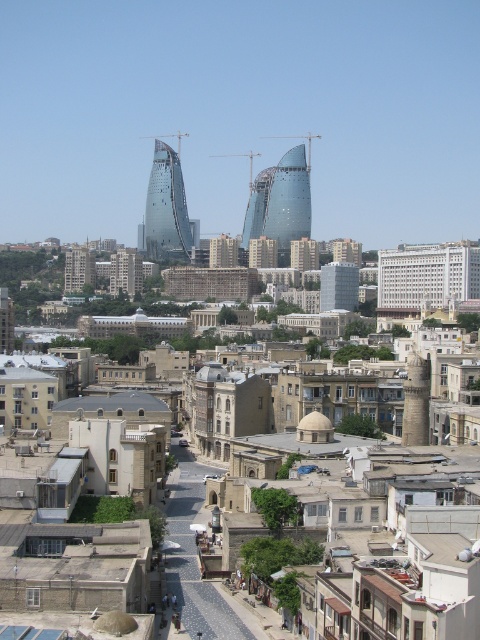
Does glassy steel tower at center have a larger size compared to glassy steel twin towers at center?

Yes, glassy steel tower at center is bigger than glassy steel twin towers at center.

Is glassy steel tower at center taller than glassy steel twin towers at center?

Incorrect, glassy steel tower at center's height is not larger of glassy steel twin towers at center's.

Measure the distance between glassy steel tower at center and camera.

They are 592.75 meters apart.

Identify the location of glassy steel tower at center. The width and height of the screenshot is (480, 640). (279, 204).

Is glassy steel tower at center to the right of matte glass building at center from the viewer's perspective?

No, glassy steel tower at center is not to the right of matte glass building at center.

Which is more to the right, glassy steel tower at center or matte glass building at center?

From the viewer's perspective, matte glass building at center appears more on the right side.

Measure the distance between glassy steel tower at center and camera.

glassy steel tower at center is 592.75 meters from camera.

Identify the location of glassy steel tower at center. This screenshot has width=480, height=640. (279, 204).

Which is in front, point (159, 189) or point (335, 282)?

Point (335, 282) is in front.

The width and height of the screenshot is (480, 640). What do you see at coordinates (167, 209) in the screenshot? I see `glassy steel twin towers at center` at bounding box center [167, 209].

Identify the location of glassy steel twin towers at center. The width and height of the screenshot is (480, 640). (167, 209).